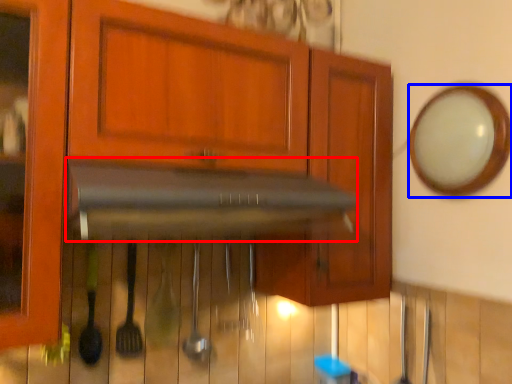
Question: Among these objects, which one is nearest to the camera, vent (highlighted by a red box) or mirror (highlighted by a blue box)?

Choices:
 (A) vent
 (B) mirror

Answer: (A)